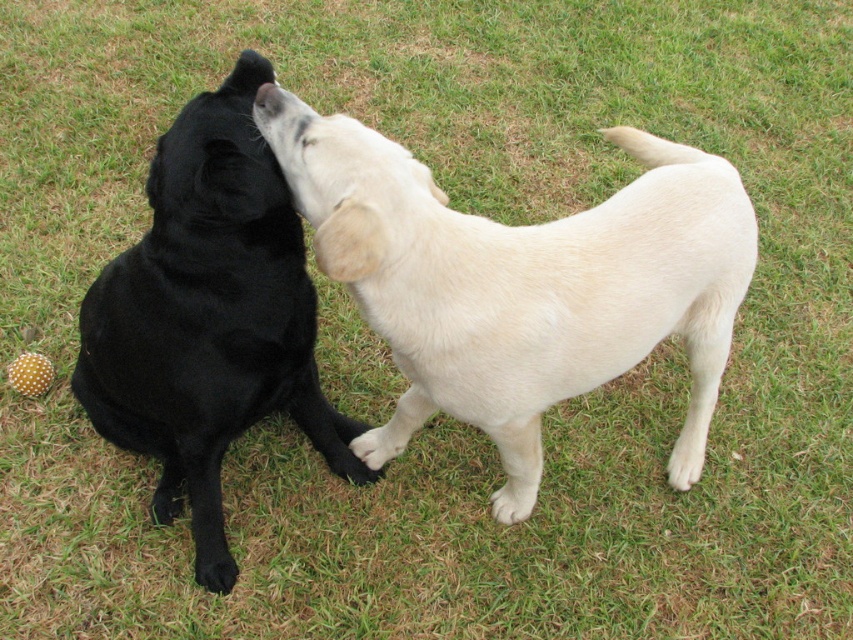
You are taking a photo of two dogs in a grassy field. You notice two specific points in the image labeled as point 1 and point 2. Point 1 has coordinates (602, 282) and point 2 has coordinates (123, 444). Which point is closer to your camera lens?

Point 1 at coordinates (602, 282) is closer to the camera lens than point 2 at coordinates (123, 444).

You are a photographer trying to capture the interaction between the shiny white dog at center and the black matte dog at center. Which dog should you focus on first if you want to take a photo from a lower angle, ensuring both are in frame?

The shiny white dog at center is above the black matte dog at center, so you should focus on the black matte dog at center first to ensure both are in frame when shooting from a lower angle.

You are a photographer setting up for a dog photo shoot. You have two dogs, a shiny white dog at center and a black matte dog at center. You need to position them so that they are exactly 20 inches apart for the perfect shot. Currently, they are positioned as described in the scene. Do you need to move them closer together or farther apart to achieve the desired distance?

The shiny white dog at center is currently 17.19 inches from the black matte dog at center. To reach the desired 20 inches, you need to move them farther apart by approximately 2.81 inches.